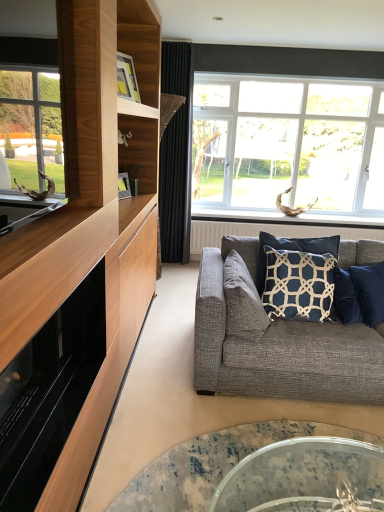
Describe the element at coordinates (242, 301) in the screenshot. I see `textured gray pillow at center, which is the 2th pillow from right to left` at that location.

The image size is (384, 512). What do you see at coordinates (212, 464) in the screenshot?
I see `translucent glass coffee table at lower center` at bounding box center [212, 464].

What is the approximate height of black velvet curtain at center?

The height of black velvet curtain at center is 2.30 meters.

What do you see at coordinates (176, 154) in the screenshot?
I see `black velvet curtain at center` at bounding box center [176, 154].

Measure the distance between point (222, 260) and camera.

A distance of 9.52 feet exists between point (222, 260) and camera.

What is the approximate width of white plastic window at upper right?

The width of white plastic window at upper right is 28.35 centimeters.

Locate an element on the screen. textured gray pillow at center, the 1th pillow viewed from the left is located at coordinates (242, 301).

Which object is further away from the camera, dark blue fabric pillow at center, the first pillow positioned from the right, or white plastic window at upper right?

white plastic window at upper right is further from the camera.

Find the location of a particular element. The height and width of the screenshot is (512, 384). the 1st pillow directly beneath the white plastic window at upper right (from a real-world perspective) is located at coordinates (298, 285).

Do you think dark blue fabric pillow at center, the first pillow positioned from the right, is within white plastic window at upper right, or outside of it?

dark blue fabric pillow at center, the first pillow positioned from the right, is not inside white plastic window at upper right, it's outside.

From a real-world perspective, is dark blue fabric pillow at center, the first pillow positioned from the right, located beneath white plastic window at upper right?

Indeed, from a real-world perspective, dark blue fabric pillow at center, the first pillow positioned from the right, is positioned beneath white plastic window at upper right.

From a real-world perspective, between white plastic window at upper right and textured gray pillow at center, the 1th pillow viewed from the left, who is vertically lower?

From a 3D spatial view, textured gray pillow at center, the 1th pillow viewed from the left, is below.

Are white plastic window at upper right and textured gray pillow at center, the 1th pillow viewed from the left, beside each other?

white plastic window at upper right and textured gray pillow at center, the 1th pillow viewed from the left, are clearly separated.

Between white plastic window at upper right and textured gray pillow at center, the 1th pillow viewed from the left, which one has smaller size?

textured gray pillow at center, the 1th pillow viewed from the left.

Which is more to the left, white plastic window at upper right or textured gray pillow at center, the 1th pillow viewed from the left?

textured gray pillow at center, the 1th pillow viewed from the left, is more to the left.

From the image's perspective, who appears lower, black velvet curtain at center or translucent glass coffee table at lower center?

From the image's view, translucent glass coffee table at lower center is below.

From a real-world perspective, relative to translucent glass coffee table at lower center, is black velvet curtain at center vertically above or below?

black velvet curtain at center is above translucent glass coffee table at lower center.

Between point (167, 132) and point (137, 493), which one is positioned behind?

The point (167, 132) is more distant.

Visually, is black velvet curtain at center positioned to the left or to the right of translucent glass coffee table at lower center?

black velvet curtain at center is to the left of translucent glass coffee table at lower center.

From the image's perspective, is white textured radiator at center positioned above or below textured gray pillow at center, which is the 2th pillow from right to left?

white textured radiator at center is situated higher than textured gray pillow at center, which is the 2th pillow from right to left, in the image.

How many degrees apart are the facing directions of white textured radiator at center and textured gray pillow at center, which is the 2th pillow from right to left?

90.1 degrees separate the facing orientations of white textured radiator at center and textured gray pillow at center, which is the 2th pillow from right to left.

Considering the sizes of objects white textured radiator at center and textured gray pillow at center, the 1th pillow viewed from the left, in the image provided, who is bigger, white textured radiator at center or textured gray pillow at center, the 1th pillow viewed from the left,?

white textured radiator at center.

Is translucent glass coffee table at lower center directly adjacent to textured gray couch at lower right?

translucent glass coffee table at lower center and textured gray couch at lower right are not in contact.

Who is smaller, translucent glass coffee table at lower center or textured gray couch at lower right?

translucent glass coffee table at lower center is smaller.

Find the location of `coffee table directly beneath the textured gray couch at lower right (from a real-world perspective)`. coffee table directly beneath the textured gray couch at lower right (from a real-world perspective) is located at coordinates (212, 464).

Is translucent glass coffee table at lower center looking in the opposite direction of textured gray couch at lower right?

Yes, translucent glass coffee table at lower center's orientation is away from textured gray couch at lower right.

Could you tell me if matte black fireplace at left is facing textured gray couch at lower right?

No, matte black fireplace at left is not aimed at textured gray couch at lower right.

Looking at this image, from a real-world perspective, is matte black fireplace at left located higher than textured gray couch at lower right?

Yes, from a real-world perspective, matte black fireplace at left is over textured gray couch at lower right

Which point is more forward, (56, 430) or (251, 346)?

Positioned in front is point (56, 430).

Considering the relative sizes of matte black fireplace at left and textured gray couch at lower right in the image provided, is matte black fireplace at left wider than textured gray couch at lower right?

Incorrect, the width of matte black fireplace at left does not surpass that of textured gray couch at lower right.

Is matte black fireplace at left in front of translucent glass coffee table at lower center?

Yes, matte black fireplace at left is closer to the camera.

How far apart are matte black fireplace at left and translucent glass coffee table at lower center?

matte black fireplace at left and translucent glass coffee table at lower center are 27.25 inches apart from each other.

Is matte black fireplace at left oriented away from translucent glass coffee table at lower center?

No.

This screenshot has width=384, height=512. I want to click on appliance that is on the left side of translucent glass coffee table at lower center, so click(49, 392).

You are a GUI agent. You are given a task and a screenshot of the screen. Output one action in this format:
    pyautogui.click(x=<x>, y=<y>)
    Task: Click on the window lying above the dark blue fabric pillow at center, the first pillow positioned from the right (from the image's perspective)
    
    Given the screenshot: What is the action you would take?
    pyautogui.click(x=287, y=145)

Where is `the 2nd pillow in front of the white plastic window at upper right, counting from the anchor's position`? the 2nd pillow in front of the white plastic window at upper right, counting from the anchor's position is located at coordinates (242, 301).

When comparing their distances from dark blue fabric pillow at center, the first pillow positioned from the right, does matte black fireplace at left or white plastic window at upper right seem further?

white plastic window at upper right is positioned further to the anchor dark blue fabric pillow at center, the first pillow positioned from the right.

Estimate the real-world distances between objects in this image. Which object is further from matte black fireplace at left, textured gray couch at lower right or white textured radiator at center?

The object further to matte black fireplace at left is white textured radiator at center.

Which object lies nearer to the anchor point matte black fireplace at left, white plastic window at upper right or textured gray couch at lower right?

The object closer to matte black fireplace at left is textured gray couch at lower right.

Based on their spatial positions, is translucent glass coffee table at lower center or textured gray couch at lower right further from textured gray pillow at center, which is the 2th pillow from right to left?

translucent glass coffee table at lower center.

Estimate the real-world distances between objects in this image. Which object is closer to translucent glass coffee table at lower center, matte black fireplace at left or white plastic window at upper right?

Among the two, matte black fireplace at left is located nearer to translucent glass coffee table at lower center.

In the scene shown: Based on their spatial positions, is white textured radiator at center or matte black fireplace at left further from translucent glass coffee table at lower center?

white textured radiator at center is positioned further to the anchor translucent glass coffee table at lower center.

From the image, which object appears to be farther from black velvet curtain at center, matte black fireplace at left or white plastic window at upper right?

Based on the image, matte black fireplace at left appears to be further to black velvet curtain at center.

From the image, which object appears to be nearer to textured gray pillow at center, which is the 2th pillow from right to left, textured gray couch at lower right or white textured radiator at center?

textured gray couch at lower right is positioned closer to the anchor textured gray pillow at center, which is the 2th pillow from right to left.

Identify the location of window between textured gray couch at lower right and white textured radiator at center in the front-back direction. This screenshot has width=384, height=512. (287, 145).

You are a GUI agent. You are given a task and a screenshot of the screen. Output one action in this format:
    pyautogui.click(x=<x>, y=<y>)
    Task: Click on the coffee table between matte black fireplace at left and white textured radiator at center in the front-back direction
    The width and height of the screenshot is (384, 512).
    Given the screenshot: What is the action you would take?
    pyautogui.click(x=212, y=464)

Locate an element on the screen. The height and width of the screenshot is (512, 384). curtain between dark blue fabric pillow at center, which is counted as the second pillow, starting from the left, and white plastic window at upper right in the front-back direction is located at coordinates (176, 154).

Find the location of a particular element. The height and width of the screenshot is (512, 384). studio couch positioned between translucent glass coffee table at lower center and white plastic window at upper right from near to far is located at coordinates (280, 347).